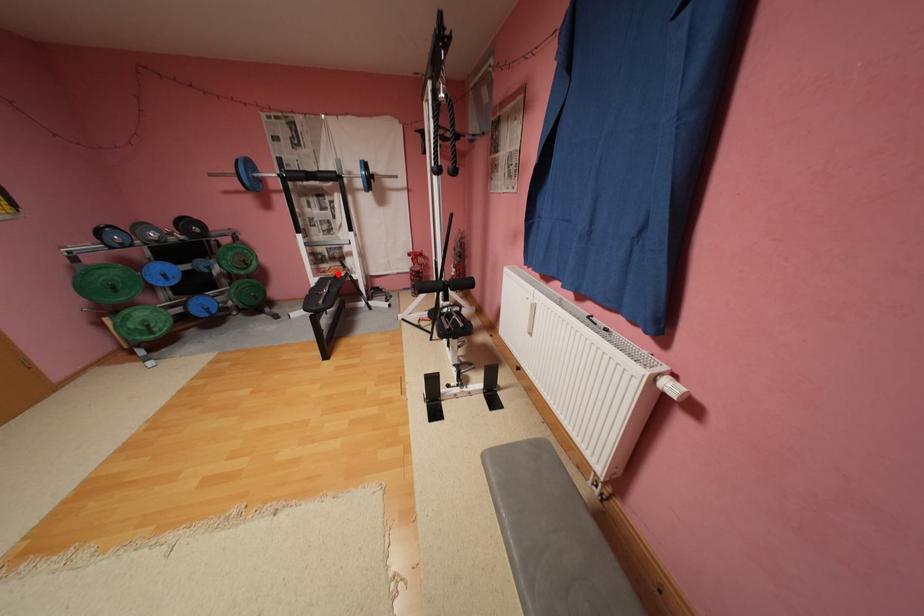
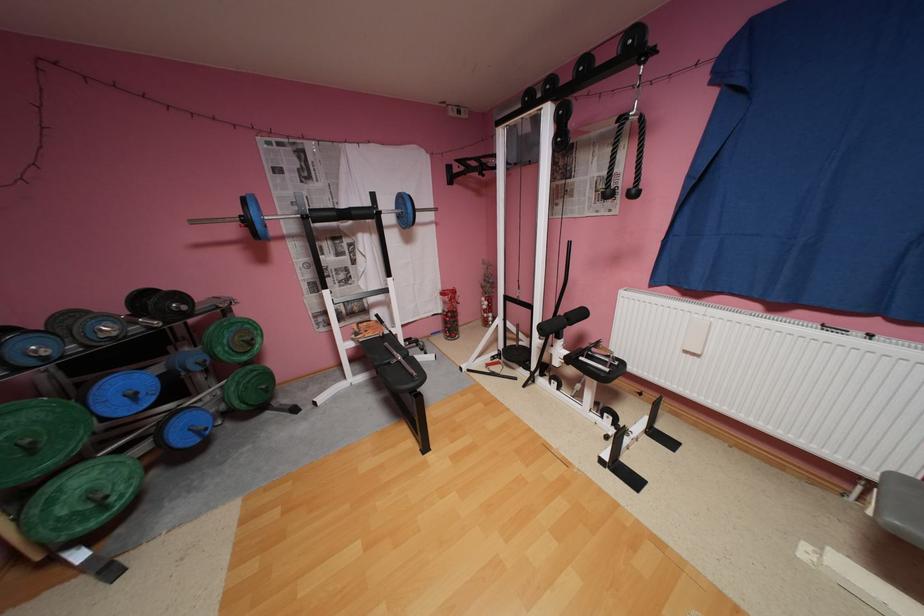
Locate, in the second image, the point that corresponds to the highlighted location in the first image.

(380, 334)